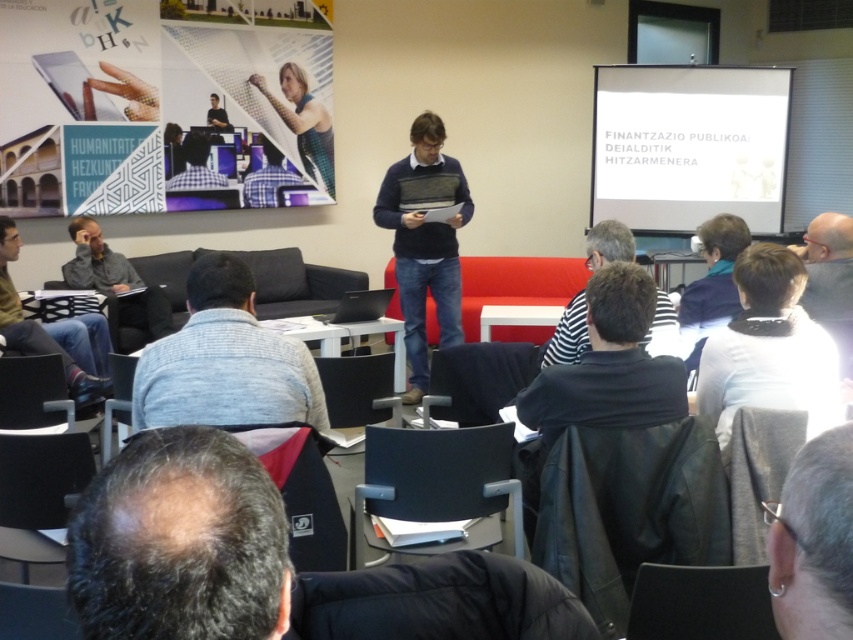
Question: Which point is closer to the camera?

Choices:
 (A) black leather jacket at center
 (B) matte black sweater at center
 (C) dark brown hair at lower center

Answer: (C)

Question: Which is farther from the gray sweater at center?

Choices:
 (A) matte black sweater at center
 (B) gray hair at upper right
 (C) white matte projection screen at upper right
 (D) white fleece at lower right

Answer: (C)

Question: Which point is farther from the camera taking this photo?

Choices:
 (A) (438, 321)
 (B) (9, 312)
 (C) (259, 202)

Answer: (C)

Question: Observing the image, what is the correct spatial positioning of white matte projection screen at upper right in reference to silver metallic earring at lower right?

Choices:
 (A) left
 (B) right

Answer: (B)

Question: Is white fleece at lower right to the right of gray sweater at left from the viewer's perspective?

Choices:
 (A) yes
 (B) no

Answer: (A)

Question: Is gray hair at upper right thinner than striped shirt at center?

Choices:
 (A) yes
 (B) no

Answer: (A)